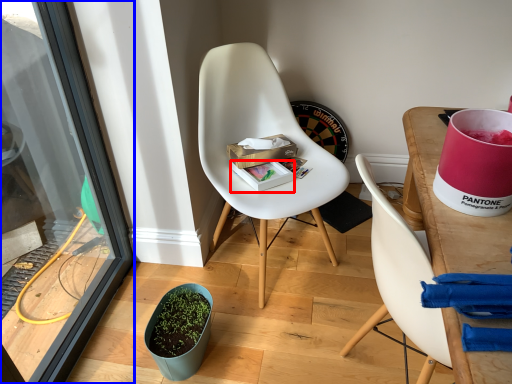
Question: Which object appears farthest to the camera in this image, box (highlighted by a red box) or screen door (highlighted by a blue box)?

Choices:
 (A) box
 (B) screen door

Answer: (A)